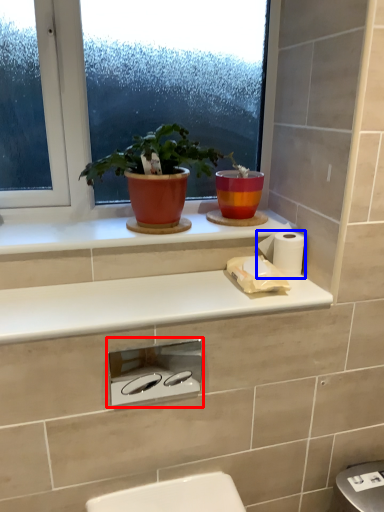
Question: Which object appears farthest to the camera in this image, appliance (highlighted by a red box) or toilet paper (highlighted by a blue box)?

Choices:
 (A) appliance
 (B) toilet paper

Answer: (B)